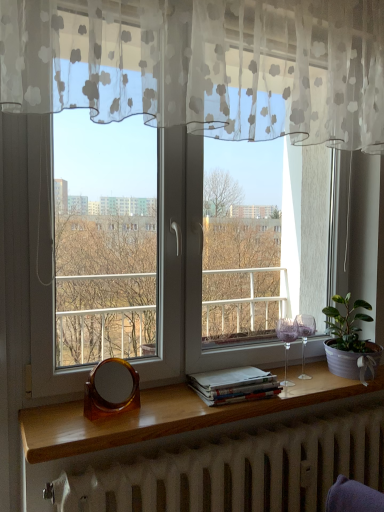
Locate an element on the screen. free location in front of brown tortoiseshell mirror at lower center is located at coordinates (103, 436).